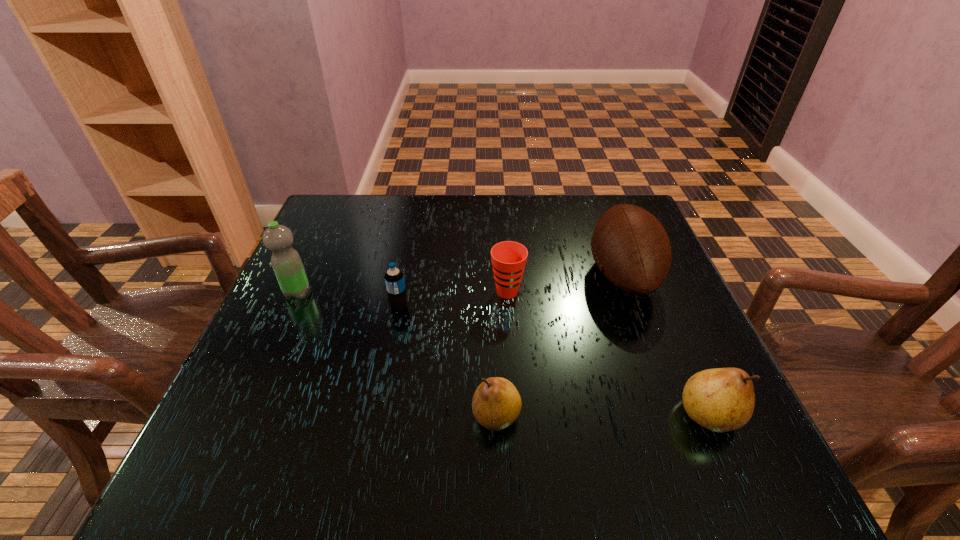
In the image, there is a desktop. Where is `free region at the far edge`? Image resolution: width=960 pixels, height=540 pixels. free region at the far edge is located at coordinates (478, 214).

In the image, there is a desktop. What are the coordinates of `vacant area at the near edge` in the screenshot? It's located at (333, 393).

Where is `vacant area at the left edge of the desktop`? Image resolution: width=960 pixels, height=540 pixels. vacant area at the left edge of the desktop is located at coordinates (297, 307).

In the image, there is a desktop. At what (x,y) coordinates should I click in order to perform the action: click on blank space at the right edge. Please return your answer as a coordinate pair (x, y). The width and height of the screenshot is (960, 540). Looking at the image, I should click on (617, 296).

Locate an element on the screen. vacant area at the far left corner is located at coordinates (338, 219).

Locate an element on the screen. This screenshot has height=540, width=960. blank space at the near left corner of the desktop is located at coordinates (297, 411).

Where is `blank space at the near right corner of the desktop`? blank space at the near right corner of the desktop is located at coordinates (674, 407).

Where is `vacant space in between the left pear and the soda bottle`? vacant space in between the left pear and the soda bottle is located at coordinates click(447, 362).

Locate an element on the screen. The image size is (960, 540). empty space that is in between the leftmost object and the left pear is located at coordinates (396, 354).

Identify the location of free space between the water bottle and the taller pear. This screenshot has height=540, width=960. (503, 354).